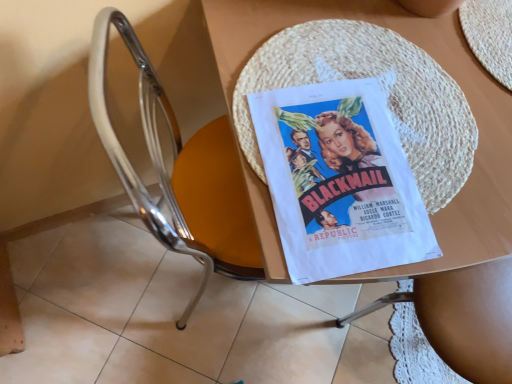
The height and width of the screenshot is (384, 512). Identify the location of vacant region in front of metallic chrome chair at center. (157, 347).